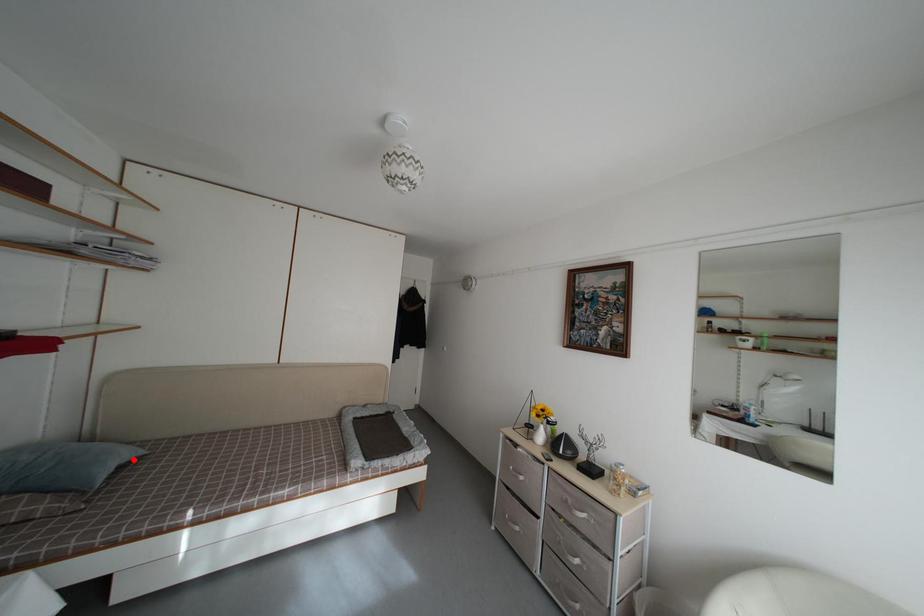
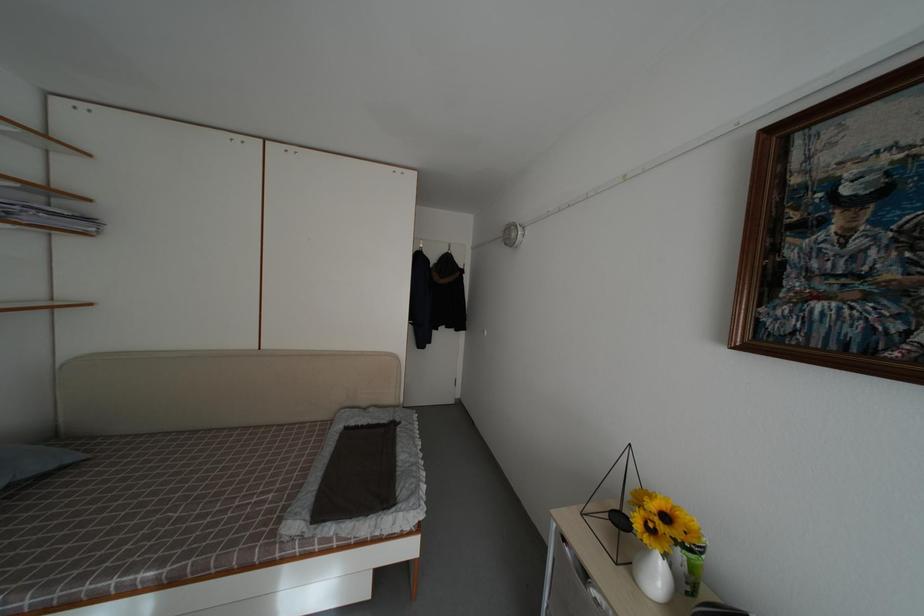
The point at the highlighted location is marked in the first image. Where is the corresponding point in the second image?

(50, 469)